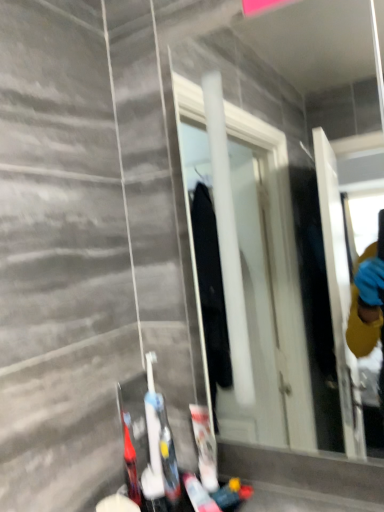
Question: Does white glossy mirror at center have a lesser width compared to white matte toothpaste tube at lower center, placed as the 3th toiletry when sorted from left to right?

Choices:
 (A) no
 (B) yes

Answer: (A)

Question: Does white glossy mirror at center have a smaller size compared to white matte toothpaste tube at lower center, which is counted as the 1th toiletry, starting from the right?

Choices:
 (A) yes
 (B) no

Answer: (B)

Question: Could you tell me if white glossy mirror at center is turned towards white matte toothpaste tube at lower center, placed as the 3th toiletry when sorted from left to right?

Choices:
 (A) no
 (B) yes

Answer: (A)

Question: From the image's perspective, does white glossy mirror at center appear higher than white matte toothpaste tube at lower center, placed as the 3th toiletry when sorted from left to right?

Choices:
 (A) no
 (B) yes

Answer: (B)

Question: Is white glossy mirror at center with white matte toothpaste tube at lower center, which is counted as the 1th toiletry, starting from the right?

Choices:
 (A) no
 (B) yes

Answer: (A)

Question: Is white glossy mirror at center to the left or to the right of translucent plastic toothbrush at lower left, the first toiletry positioned from the left, in the image?

Choices:
 (A) left
 (B) right

Answer: (B)

Question: Relative to translucent plastic toothbrush at lower left, the first toiletry positioned from the left, is white glossy mirror at center in front or behind?

Choices:
 (A) front
 (B) behind

Answer: (A)

Question: Is white glossy mirror at center wider or thinner than translucent plastic toothbrush at lower left, the first toiletry positioned from the left?

Choices:
 (A) wide
 (B) thin

Answer: (A)

Question: Considering the positions of white glossy mirror at center and translucent plastic toothbrush at lower left, which is the third toiletry from right to left, in the image, is white glossy mirror at center taller or shorter than translucent plastic toothbrush at lower left, which is the third toiletry from right to left,?

Choices:
 (A) tall
 (B) short

Answer: (A)

Question: Considering the positions of point (296, 60) and point (168, 460), is point (296, 60) closer or farther from the camera than point (168, 460)?

Choices:
 (A) closer
 (B) farther

Answer: (B)

Question: Do you think white glossy mirror at center is within white plastic toothbrush at lower center, the second toiletry from the left, or outside of it?

Choices:
 (A) outside
 (B) inside

Answer: (A)

Question: Considering their positions, is white glossy mirror at center located in front of or behind white plastic toothbrush at lower center, the second toiletry from the left?

Choices:
 (A) front
 (B) behind

Answer: (A)

Question: Is white glossy mirror at center bigger or smaller than white plastic toothbrush at lower center, the second toiletry in the right-to-left sequence?

Choices:
 (A) small
 (B) big

Answer: (B)

Question: Do you think white plastic toothbrush at lower center, the second toiletry from the left, is within translucent plastic toothbrush at lower left, which is the third toiletry from right to left, or outside of it?

Choices:
 (A) inside
 (B) outside

Answer: (B)

Question: Is point (160, 431) closer or farther from the camera than point (127, 459)?

Choices:
 (A) farther
 (B) closer

Answer: (A)